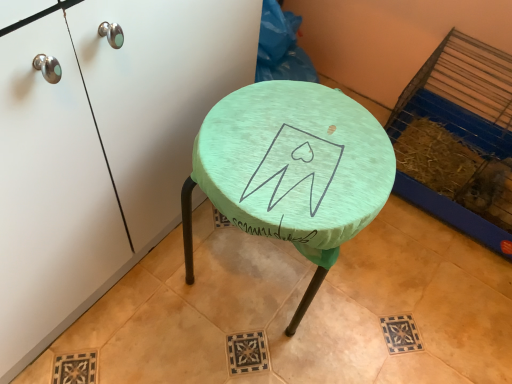
The image size is (512, 384). Find the location of `empty space that is to the right of teal fabric stool at center`. empty space that is to the right of teal fabric stool at center is located at coordinates (390, 299).